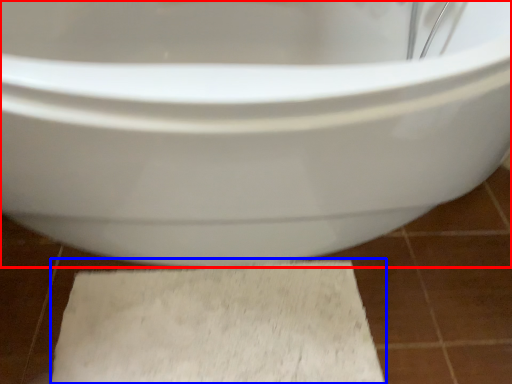
Question: Which point is further to the camera, toilet (highlighted by a red box) or bath mat (highlighted by a blue box)?

Choices:
 (A) toilet
 (B) bath mat

Answer: (B)